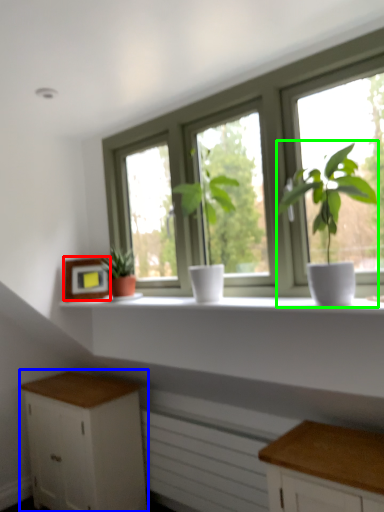
Question: Based on their relative distances, which object is farther from picture frame (highlighted by a red box)? Choose from cabinetry (highlighted by a blue box) and houseplant (highlighted by a green box).

Choices:
 (A) cabinetry
 (B) houseplant

Answer: (B)